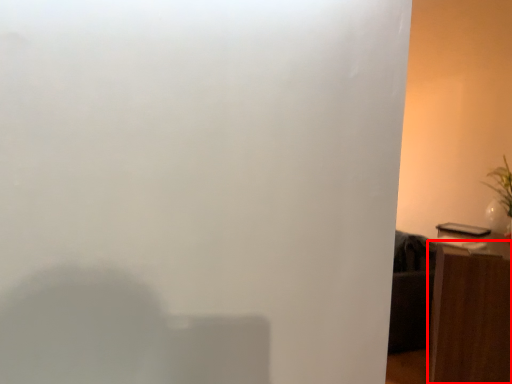
Question: In this image, where is furniture (annotated by the red box) located relative to plant?

Choices:
 (A) left
 (B) right

Answer: (A)